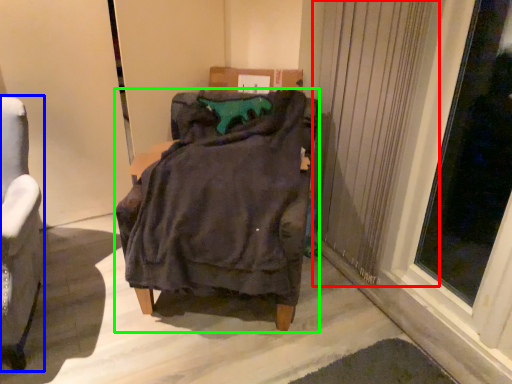
Question: Estimate the real-world distances between objects in this image. Which object is farther from curtain (highlighted by a red box), chair (highlighted by a blue box) or furniture (highlighted by a green box)?

Choices:
 (A) chair
 (B) furniture

Answer: (A)